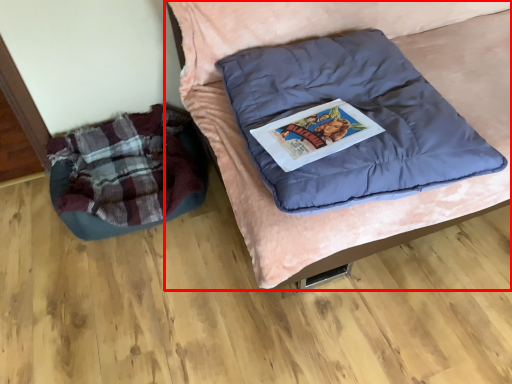
Question: From the image's perspective, where is furniture (annotated by the red box) located in relation to bean bag chair in the image?

Choices:
 (A) below
 (B) above

Answer: (B)